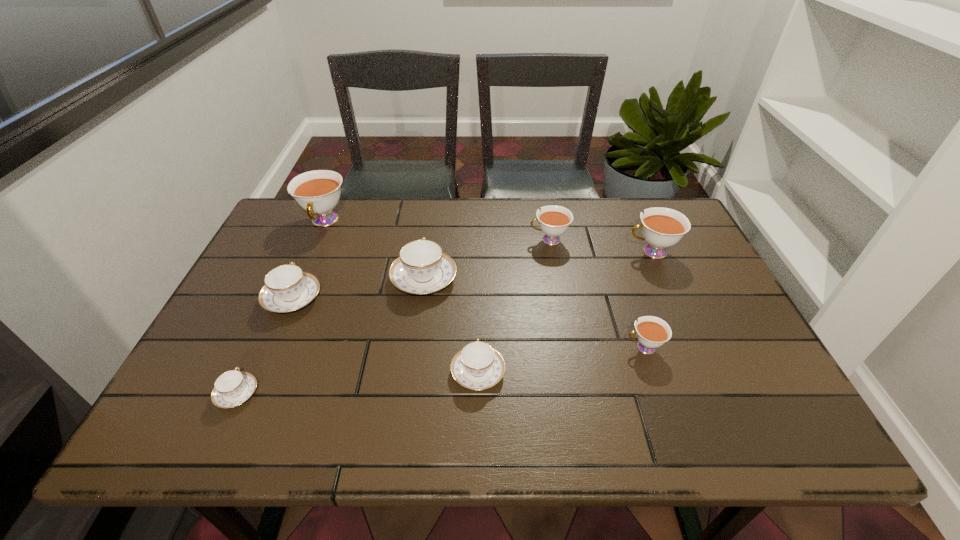
This screenshot has width=960, height=540. In order to click on the tallest object in this screenshot , I will do `click(318, 192)`.

What are the coordinates of `the leftmost white teacup` in the screenshot? It's located at (318, 192).

Where is `the second tallest teacup`? This screenshot has height=540, width=960. the second tallest teacup is located at coordinates (662, 227).

Locate an element on the screen. the third smallest white teacup is located at coordinates (662, 227).

You are a GUI agent. You are given a task and a screenshot of the screen. Output one action in this format:
    pyautogui.click(x=<x>, y=<y>)
    Task: Click on the biggest blue teacup
    The width and height of the screenshot is (960, 540).
    Given the screenshot: What is the action you would take?
    pyautogui.click(x=422, y=268)

The width and height of the screenshot is (960, 540). Identify the location of the third object from right to left. (554, 220).

The height and width of the screenshot is (540, 960). I want to click on the second white teacup from left to right, so click(x=554, y=220).

Find the location of a particular element. The image size is (960, 540). the third smallest blue teacup is located at coordinates (287, 288).

Identify the location of the nearest white teacup. The width and height of the screenshot is (960, 540). (652, 332).

Find the location of a particular element. The image size is (960, 540). the second smallest blue teacup is located at coordinates (477, 366).